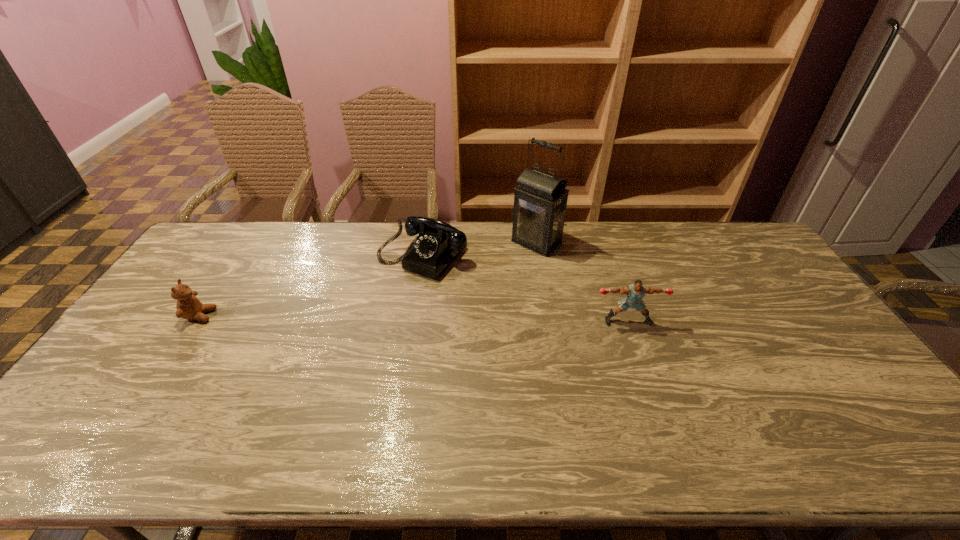
I want to click on vacant space on the desktop that is between the teddy bear and the rightmost object and is positioned on the dial of the telephone, so click(363, 318).

This screenshot has height=540, width=960. What are the coordinates of `free spot on the desktop that is between the shortest object and the rightmost object and is positioned on the front-facing side of the lantern` in the screenshot? It's located at (446, 319).